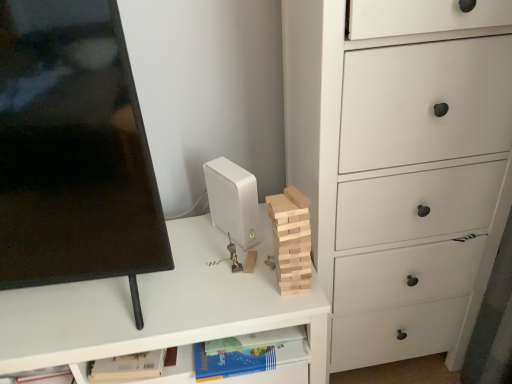
Question: Relative to black glossy computer monitor at left, is white matte desktop computer at center in front or behind?

Choices:
 (A) front
 (B) behind

Answer: (B)

Question: From the image's perspective, is white matte desktop computer at center positioned above or below black glossy computer monitor at left?

Choices:
 (A) below
 (B) above

Answer: (A)

Question: Which is nearer to the black glossy computer monitor at left?

Choices:
 (A) white matte chest of drawers at right
 (B) white matte desktop computer at center
 (C) blue paper book at lower center
 (D) natural wood block at center
 (E) white matte desk at center

Answer: (E)

Question: Based on their relative distances, which object is nearer to the black glossy computer monitor at left?

Choices:
 (A) blue paper book at lower center
 (B) white matte desktop computer at center
 (C) natural wood block at center
 (D) white matte desk at center
 (E) white matte chest of drawers at right

Answer: (D)